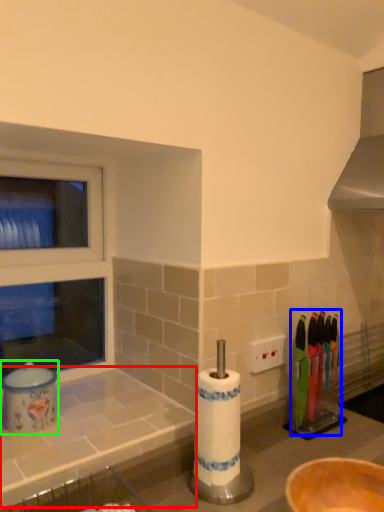
Question: Considering the real-world distances, which object is closest to counter top (highlighted by a red box)? tableware (highlighted by a blue box) or appliance (highlighted by a green box).

Choices:
 (A) tableware
 (B) appliance

Answer: (B)